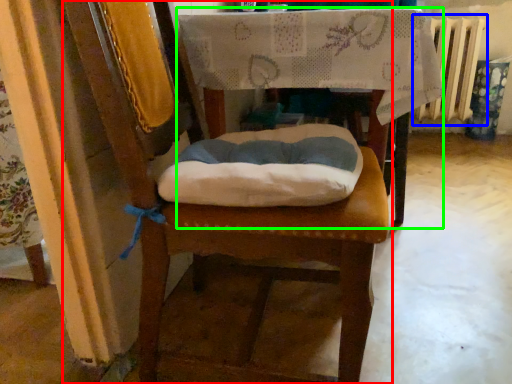
Question: Considering the real-world distances, which object is closest to chair (highlighted by a red box)? radiator (highlighted by a blue box) or table (highlighted by a green box).

Choices:
 (A) radiator
 (B) table

Answer: (B)